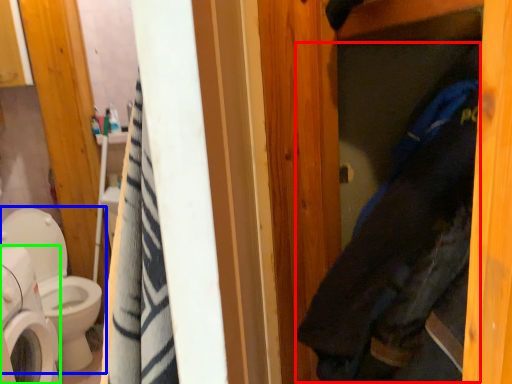
Question: Which object is the closest to the clothing (highlighted by a red box)? Choose among these: toilet (highlighted by a blue box) or washing machine (highlighted by a green box).

Choices:
 (A) toilet
 (B) washing machine

Answer: (B)